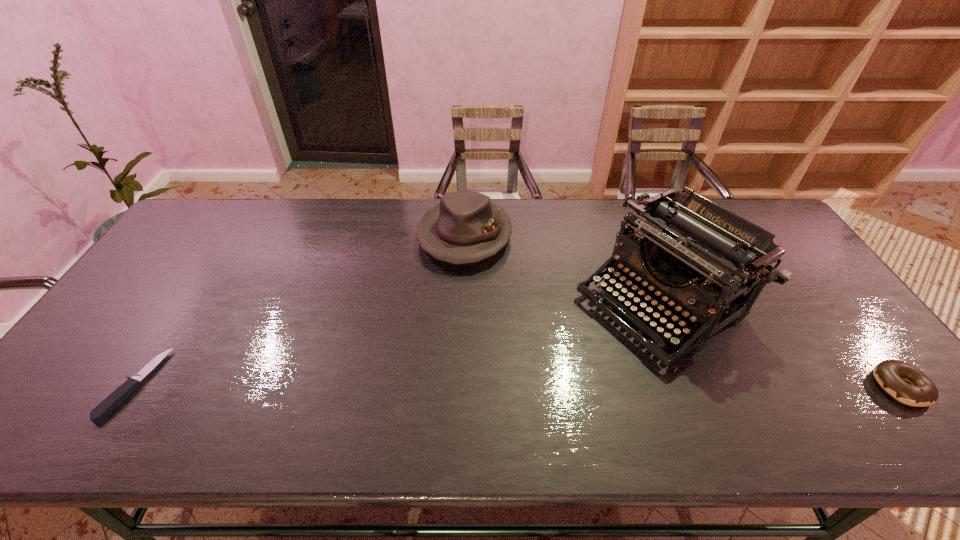
The image size is (960, 540). In order to click on vacant space on the desktop that is between the steak knife and the rightmost object and is positioned on the typing side of the tallest object in this screenshot , I will do `click(525, 386)`.

Locate an element on the screen. vacant space on the desktop that is between the steak knife and the doughnut and is positioned on the decorative side of the hat is located at coordinates (427, 386).